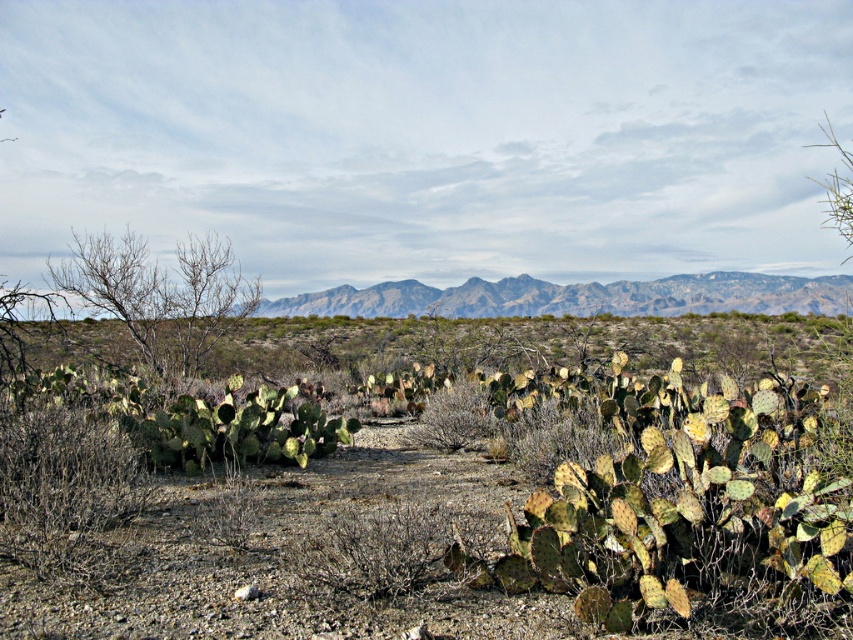
Can you confirm if green spiny cactus at center is positioned below gray rocky mountains at center?

Yes, green spiny cactus at center is below gray rocky mountains at center.

Is point (460, 532) closer to viewer compared to point (844, 307)?

Yes, it is in front of point (844, 307).

The image size is (853, 640). What do you see at coordinates (427, 490) in the screenshot? I see `green spiny cactus at center` at bounding box center [427, 490].

You are a GUI agent. You are given a task and a screenshot of the screen. Output one action in this format:
    pyautogui.click(x=<x>, y=<y>)
    Task: Click on the green spiny cactus at center
    This screenshot has width=853, height=640.
    Given the screenshot: What is the action you would take?
    pyautogui.click(x=427, y=490)